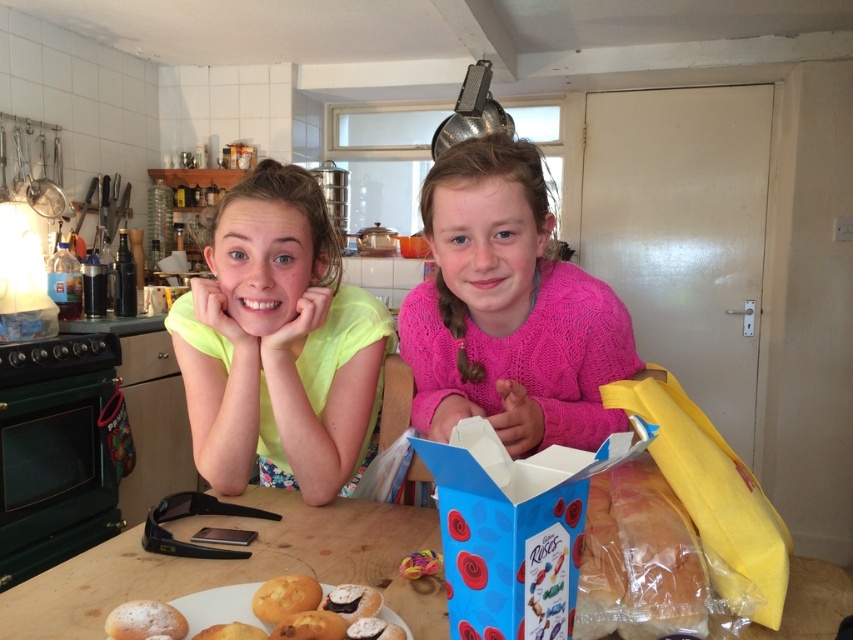
Question: Among these points, which one is farthest from the camera?

Choices:
 (A) (178, 596)
 (B) (556, 528)
 (C) (614, 326)
 (D) (172, 609)

Answer: (C)

Question: Among these points, which one is farthest from the camera?

Choices:
 (A) (498, 470)
 (B) (502, 236)
 (C) (151, 616)

Answer: (B)

Question: Is pink knitted sweater at center bigger than wooden table at center?

Choices:
 (A) no
 (B) yes

Answer: (B)

Question: Which of these objects is positioned closest to the chocolate frosted cookie at center?

Choices:
 (A) pink knitted sweater at center
 (B) wooden table at center
 (C) golden brown bread at lower left

Answer: (C)

Question: Can you confirm if wooden table at center is positioned below golden brown bread at lower left?

Choices:
 (A) yes
 (B) no

Answer: (A)

Question: Can you confirm if neon yellow shirt at center is wider than chocolate frosted cookie at center?

Choices:
 (A) no
 (B) yes

Answer: (B)